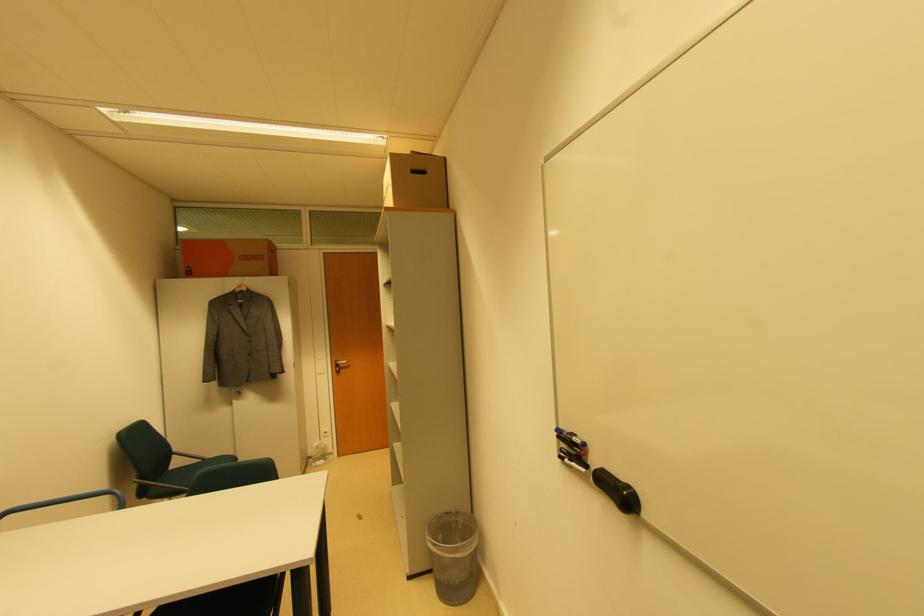
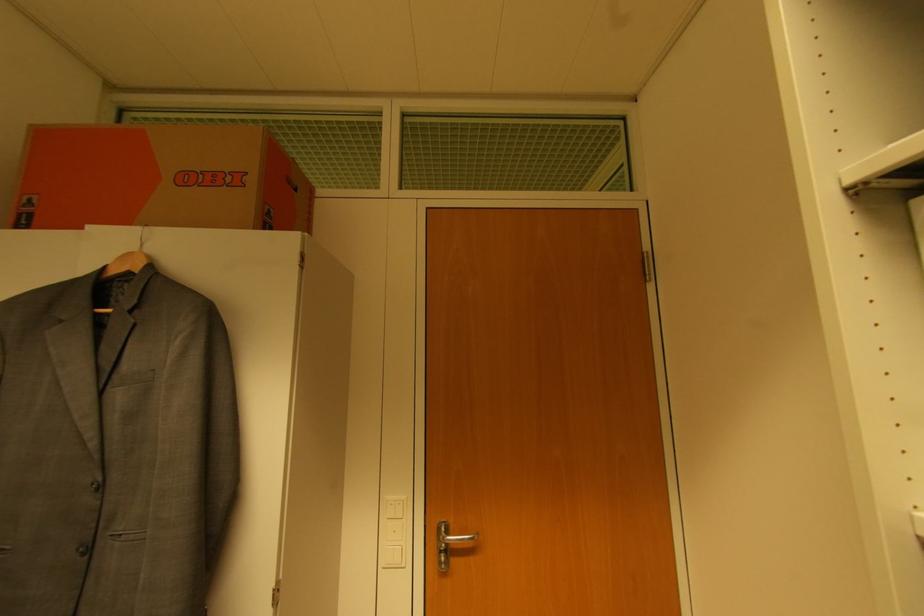
Where in the second image is the point corresponding to point (247, 292) from the first image?

(137, 270)